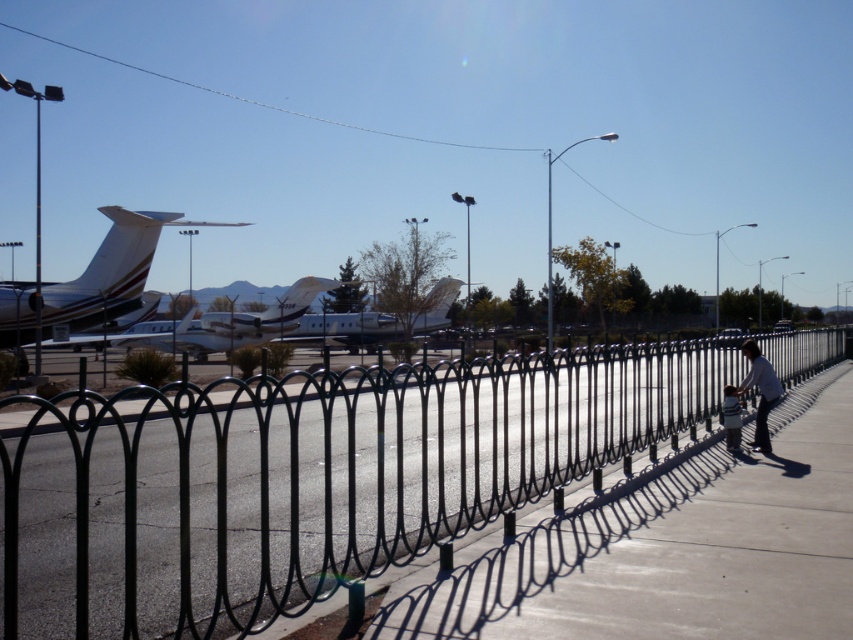
Question: In this image, where is white glossy airplane at center located relative to white fabric shirt at lower right?

Choices:
 (A) above
 (B) below

Answer: (A)

Question: Is white glossy airplane at left to the right of white metallic airplane at center from the viewer's perspective?

Choices:
 (A) no
 (B) yes

Answer: (A)

Question: Which object is farther from the camera taking this photo?

Choices:
 (A) black wrought iron fence at center
 (B) white glossy airplane at left
 (C) white metallic airplane at center

Answer: (C)

Question: Is black wrought iron fence at center closer to camera compared to white fabric shirt at lower right?

Choices:
 (A) yes
 (B) no

Answer: (A)

Question: Among these points, which one is farthest from the camera?

Choices:
 (A) (778, 390)
 (B) (722, 413)
 (C) (328, 323)

Answer: (C)

Question: Which object is positioned farthest from the light blue shirt at right?

Choices:
 (A) black wrought iron fence at center
 (B) white glossy airplane at left
 (C) white glossy airplane at center

Answer: (C)